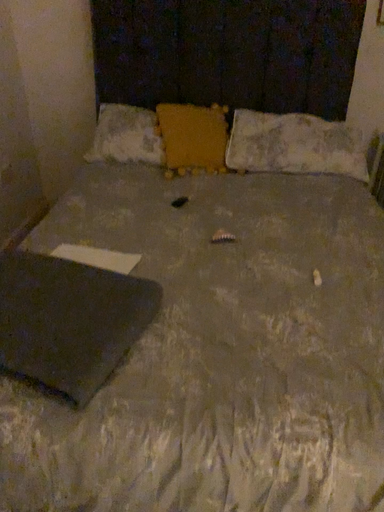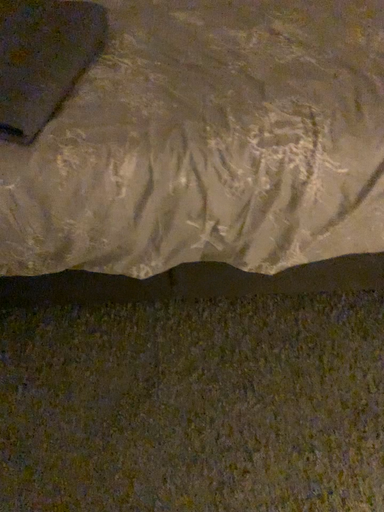
Question: How did the camera likely rotate when shooting the video?

Choices:
 (A) rotated upward
 (B) rotated downward

Answer: (B)